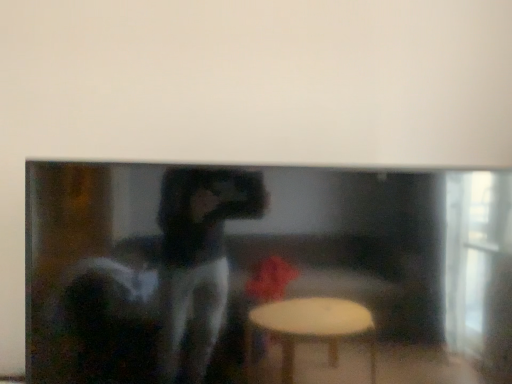
The image size is (512, 384). What do you see at coordinates (214, 262) in the screenshot?
I see `matte black fireplace at center` at bounding box center [214, 262].

You are a GUI agent. You are given a task and a screenshot of the screen. Output one action in this format:
    pyautogui.click(x=<x>, y=<y>)
    Task: Click on the matte black fireplace at center
    This screenshot has width=512, height=384.
    Given the screenshot: What is the action you would take?
    pyautogui.click(x=214, y=262)

Identify the location of matte black fireplace at center. This screenshot has width=512, height=384. click(214, 262).